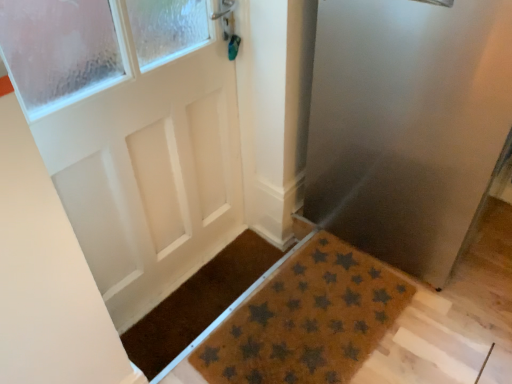
Describe the element at coordinates (197, 303) in the screenshot. I see `brown coir mat at center, which is the 1th doormat in left-to-right order` at that location.

You are a GUI agent. You are given a task and a screenshot of the screen. Output one action in this format:
    pyautogui.click(x=<x>, y=<y>)
    Task: Click on the brown textured mat at lower right
    This screenshot has width=512, height=384.
    Given the screenshot: What is the action you would take?
    pos(407,125)

Between brown textured mat at lower right and brown coir mat with star pattern at lower center, the second doormat viewed from the left, which one has more height?

With more height is brown textured mat at lower right.

Looking at this image, which of these two, brown textured mat at lower right or brown coir mat with star pattern at lower center, the second doormat viewed from the left, is thinner?

Thinner between the two is brown coir mat with star pattern at lower center, the second doormat viewed from the left.

Considering the positions of objects brown textured mat at lower right and brown coir mat with star pattern at lower center, the first doormat from the right, in the image provided, who is more to the right, brown textured mat at lower right or brown coir mat with star pattern at lower center, the first doormat from the right,?

From the viewer's perspective, brown textured mat at lower right appears more on the right side.

Is brown textured mat at lower right touching brown coir mat with star pattern at lower center, the first doormat from the right?

No.

Locate an element on the screen. doormat above the brown coir mat at center, which is the 1th doormat in left-to-right order (from a real-world perspective) is located at coordinates point(307,320).

In the image, is brown coir mat with star pattern at lower center, the second doormat viewed from the left, on the left side or the right side of brown coir mat at center, which is the 1th doormat in left-to-right order?

Clearly, brown coir mat with star pattern at lower center, the second doormat viewed from the left, is on the right of brown coir mat at center, which is the 1th doormat in left-to-right order, in the image.

In the scene shown: Is brown coir mat with star pattern at lower center, the first doormat from the right, next to brown coir mat at center, acting as the second doormat starting from the right, and touching it?

No.

From the image's perspective, is brown coir mat with star pattern at lower center, the first doormat from the right, located above or below brown coir mat at center, which is the 1th doormat in left-to-right order?

From the image's perspective, brown coir mat with star pattern at lower center, the first doormat from the right, appears below brown coir mat at center, which is the 1th doormat in left-to-right order.

From a real-world perspective, does brown textured mat at lower right sit lower than brown coir mat at center, which is the 1th doormat in left-to-right order?

No, from a real-world perspective, brown textured mat at lower right is not beneath brown coir mat at center, which is the 1th doormat in left-to-right order.

Is brown textured mat at lower right shorter than brown coir mat at center, acting as the second doormat starting from the right?

In fact, brown textured mat at lower right may be taller than brown coir mat at center, acting as the second doormat starting from the right.

Considering the relative sizes of brown textured mat at lower right and brown coir mat at center, which is the 1th doormat in left-to-right order, in the image provided, is brown textured mat at lower right smaller than brown coir mat at center, which is the 1th doormat in left-to-right order,?

Actually, brown textured mat at lower right might be larger than brown coir mat at center, which is the 1th doormat in left-to-right order.

Is brown textured mat at lower right inside the boundaries of brown coir mat at center, acting as the second doormat starting from the right, or outside?

brown textured mat at lower right lies outside brown coir mat at center, acting as the second doormat starting from the right.

Is brown coir mat at center, which is the 1th doormat in left-to-right order, oriented away from brown coir mat with star pattern at lower center, the first doormat from the right?

That's not correct — brown coir mat at center, which is the 1th doormat in left-to-right order, is not looking away from brown coir mat with star pattern at lower center, the first doormat from the right.

Between brown coir mat at center, acting as the second doormat starting from the right, and brown coir mat with star pattern at lower center, the second doormat viewed from the left, which one is positioned in front?

Positioned in front is brown coir mat with star pattern at lower center, the second doormat viewed from the left.

Considering the sizes of objects brown coir mat at center, acting as the second doormat starting from the right, and brown coir mat with star pattern at lower center, the second doormat viewed from the left, in the image provided, who is smaller, brown coir mat at center, acting as the second doormat starting from the right, or brown coir mat with star pattern at lower center, the second doormat viewed from the left,?

With smaller size is brown coir mat at center, acting as the second doormat starting from the right.

Who is taller, brown coir mat with star pattern at lower center, the second doormat viewed from the left, or brown textured mat at lower right?

With more height is brown textured mat at lower right.

Can you tell me how much brown coir mat with star pattern at lower center, the first doormat from the right, and brown textured mat at lower right differ in facing direction?

They differ by 0.403 degrees in their facing directions.

Is brown coir mat with star pattern at lower center, the first doormat from the right, inside or outside of brown textured mat at lower right?

brown coir mat with star pattern at lower center, the first doormat from the right, is located beyond the bounds of brown textured mat at lower right.

Is brown coir mat with star pattern at lower center, the first doormat from the right, facing away from brown textured mat at lower right?

brown coir mat with star pattern at lower center, the first doormat from the right, is not turned away from brown textured mat at lower right.

Are brown coir mat at center, which is the 1th doormat in left-to-right order, and brown textured mat at lower right far apart?

They are positioned close to each other.

Does brown coir mat at center, which is the 1th doormat in left-to-right order, come in front of brown textured mat at lower right?

That is False.

Is brown coir mat at center, which is the 1th doormat in left-to-right order, aimed at brown textured mat at lower right?

No, brown coir mat at center, which is the 1th doormat in left-to-right order, is not turned towards brown textured mat at lower right.

From a real-world perspective, is brown coir mat at center, which is the 1th doormat in left-to-right order, positioned above or below brown textured mat at lower right?

From a real-world perspective, brown coir mat at center, which is the 1th doormat in left-to-right order, is physically below brown textured mat at lower right.

Image resolution: width=512 pixels, height=384 pixels. What are the coordinates of `screen door that is above the brown coir mat with star pattern at lower center, the first doormat from the right (from the image's perspective)` in the screenshot? It's located at (407, 125).

What are the coordinates of `doormat on the right of brown coir mat at center, acting as the second doormat starting from the right` in the screenshot? It's located at (307, 320).

Estimate the real-world distances between objects in this image. Which object is closer to brown textured mat at lower right, brown coir mat with star pattern at lower center, the first doormat from the right, or brown coir mat at center, which is the 1th doormat in left-to-right order?

brown coir mat with star pattern at lower center, the first doormat from the right.

Based on their spatial positions, is brown coir mat with star pattern at lower center, the first doormat from the right, or brown textured mat at lower right closer to brown coir mat at center, which is the 1th doormat in left-to-right order?

The object closer to brown coir mat at center, which is the 1th doormat in left-to-right order, is brown coir mat with star pattern at lower center, the first doormat from the right.

Based on their spatial positions, is brown coir mat at center, acting as the second doormat starting from the right, or brown textured mat at lower right closer to brown coir mat with star pattern at lower center, the second doormat viewed from the left?

brown coir mat at center, acting as the second doormat starting from the right, is closer to brown coir mat with star pattern at lower center, the second doormat viewed from the left.

Considering their positions, is brown textured mat at lower right positioned further to brown coir mat with star pattern at lower center, the second doormat viewed from the left, than brown coir mat at center, which is the 1th doormat in left-to-right order?

brown textured mat at lower right is positioned further to the anchor brown coir mat with star pattern at lower center, the second doormat viewed from the left.

Which object lies nearer to the anchor point brown coir mat at center, which is the 1th doormat in left-to-right order, brown textured mat at lower right or brown coir mat with star pattern at lower center, the first doormat from the right?

Based on the image, brown coir mat with star pattern at lower center, the first doormat from the right, appears to be nearer to brown coir mat at center, which is the 1th doormat in left-to-right order.

Based on their spatial positions, is brown coir mat at center, which is the 1th doormat in left-to-right order, or brown coir mat with star pattern at lower center, the second doormat viewed from the left, further from brown textured mat at lower right?

Among the two, brown coir mat at center, which is the 1th doormat in left-to-right order, is located further to brown textured mat at lower right.

This screenshot has width=512, height=384. What are the coordinates of `doormat between brown coir mat at center, acting as the second doormat starting from the right, and brown textured mat at lower right, in the horizontal direction` in the screenshot? It's located at (307, 320).